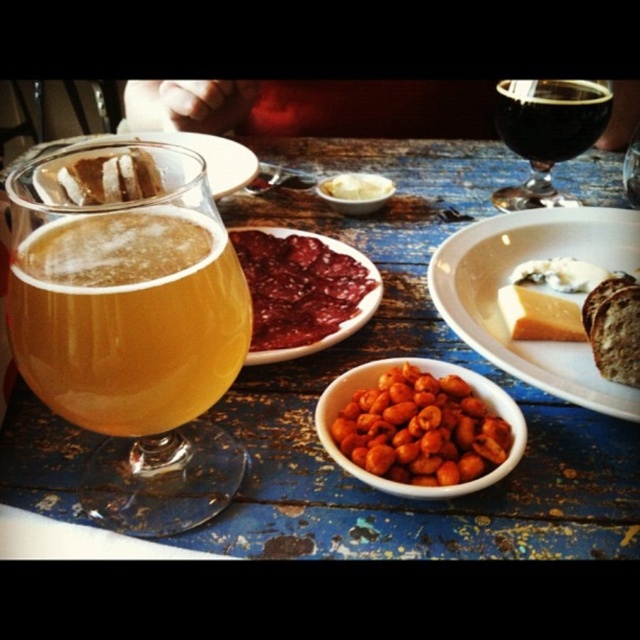
Question: Among these objects, which one is farthest from the camera?

Choices:
 (A) orange matte nuts at center
 (B) amber glass at left
 (C) wooden table at center
 (D) white creamy spread at center

Answer: (D)

Question: Which point is farther from the camera taking this photo?

Choices:
 (A) (344, 307)
 (B) (477, 396)
 (C) (371, 192)

Answer: (C)

Question: Does orange matte nuts at center appear on the left side of white creamy spread at center?

Choices:
 (A) yes
 (B) no

Answer: (B)

Question: Can you confirm if orange matte nuts at center is positioned below white creamy spread at center?

Choices:
 (A) yes
 (B) no

Answer: (A)

Question: Observing the image, what is the correct spatial positioning of smooth red jam at center in reference to dark glass wine at upper right?

Choices:
 (A) left
 (B) right

Answer: (A)

Question: Which object is the farthest from the white matte plate at center?

Choices:
 (A) dark glass wine at upper right
 (B) white creamy spread at center
 (C) wooden table at center
 (D) amber glass at left

Answer: (D)